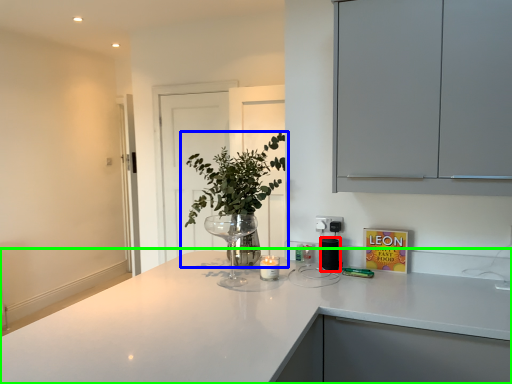
Question: Based on their relative distances, which object is farther from appliance (highlighted by a red box)? Choose from houseplant (highlighted by a blue box) and countertop (highlighted by a green box).

Choices:
 (A) houseplant
 (B) countertop

Answer: (B)